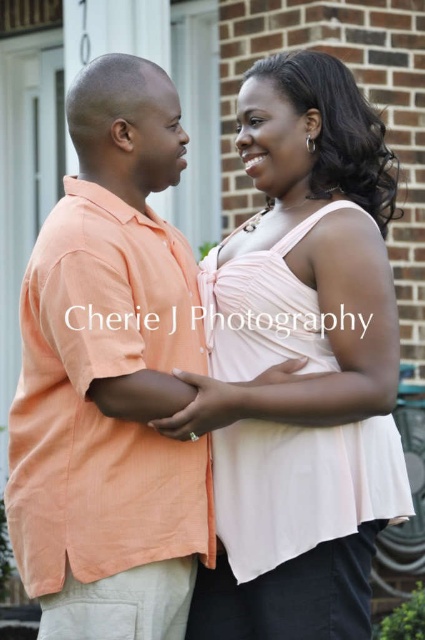
From the picture: You are a fashion designer observing a couple in an outdoor setting. You notice the matte pink dress at center and the orange linen shirt at left. Which clothing item has a greater height measurement?

The matte pink dress at center is taller than the orange linen shirt at left, so the matte pink dress at center has a greater height measurement.

You are a photographer setting up a shoot in this scene. You need to place a small prop between the matte pink dress at center and the orange linen shirt at left. Based on their positions, where should you place the prop to ensure it is between them?

The matte pink dress at center is above the orange linen shirt at left, so you should place the prop in the middle area between them, horizontally aligned with the orange linen shirt at left and vertically below the matte pink dress at center.